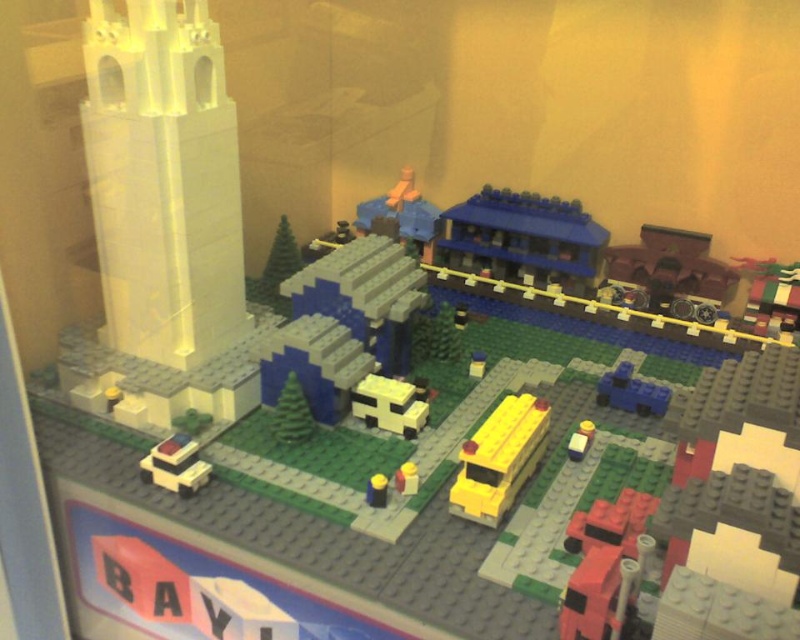
Question: Which point is farther to the camera?

Choices:
 (A) click(700, 250)
 (B) click(541, 417)

Answer: (A)

Question: Is metallic silver car at center right to the left of yellow plastic bus at center from the viewer's perspective?

Choices:
 (A) yes
 (B) no

Answer: (B)

Question: From the image, what is the correct spatial relationship of yellow matte bus at center in relation to smooth beige building at lower left?

Choices:
 (A) right
 (B) left

Answer: (A)

Question: Estimate the real-world distances between objects in this image. Which object is farther from the metallic silver car at center right?

Choices:
 (A) yellow matte bench at center
 (B) yellow matte bus at center
 (C) yellow plastic bus at center

Answer: (A)

Question: Estimate the real-world distances between objects in this image. Which object is farther from the metallic silver car at center right?

Choices:
 (A) yellow matte bus at center
 (B) blue matte brick at center-right

Answer: (A)

Question: Does white plastic tower at left have a greater width compared to smooth beige building at lower left?

Choices:
 (A) no
 (B) yes

Answer: (B)